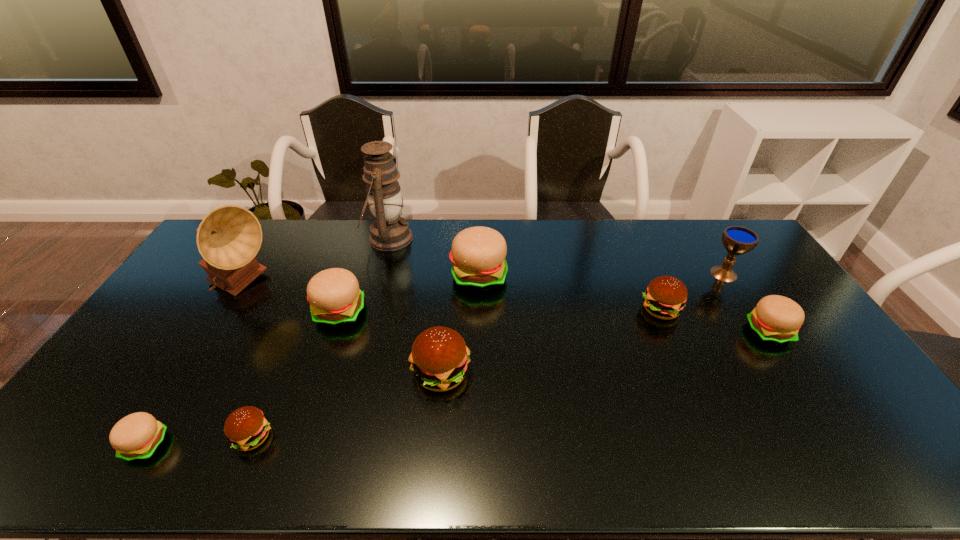
The width and height of the screenshot is (960, 540). I want to click on hamburger at the right edge, so click(776, 319).

The height and width of the screenshot is (540, 960). Find the location of `free space at the far edge of the desktop`. free space at the far edge of the desktop is located at coordinates [x=282, y=231].

You are a GUI agent. You are given a task and a screenshot of the screen. Output one action in this format:
    pyautogui.click(x=<x>, y=<y>)
    Task: Click on the blank space at the near edge
    This screenshot has height=540, width=960.
    Given the screenshot: What is the action you would take?
    pyautogui.click(x=336, y=444)

In the image, there is a desktop. Identify the location of blank space at the right edge. This screenshot has height=540, width=960. (829, 400).

Find the location of a particular element. The width and height of the screenshot is (960, 540). vacant point located between the smallest beige hamburger and the third smallest beige hamburger is located at coordinates [243, 379].

You are a GUI agent. You are given a task and a screenshot of the screen. Output one action in this format:
    pyautogui.click(x=<x>, y=<y>)
    Task: Click on the vacant area between the leftmost beige hamburger and the nearest brown hamburger
    
    Given the screenshot: What is the action you would take?
    pyautogui.click(x=200, y=441)

This screenshot has width=960, height=540. Find the location of `free space between the leftmost beige hamburger and the third beige hamburger from right to left`. free space between the leftmost beige hamburger and the third beige hamburger from right to left is located at coordinates (243, 379).

Locate an element on the screen. The height and width of the screenshot is (540, 960). empty location between the chalice and the third beige hamburger from left to right is located at coordinates (601, 275).

You are a GUI agent. You are given a task and a screenshot of the screen. Output one action in this format:
    pyautogui.click(x=<x>, y=<y>)
    Task: Click on the empty space that is in between the second beige hamburger from left to right and the second farthest brown hamburger
    
    Given the screenshot: What is the action you would take?
    pyautogui.click(x=391, y=343)

Find the location of a particular element. This screenshot has height=540, width=960. vacant point located between the rightmost hamburger and the second tallest object is located at coordinates (505, 309).